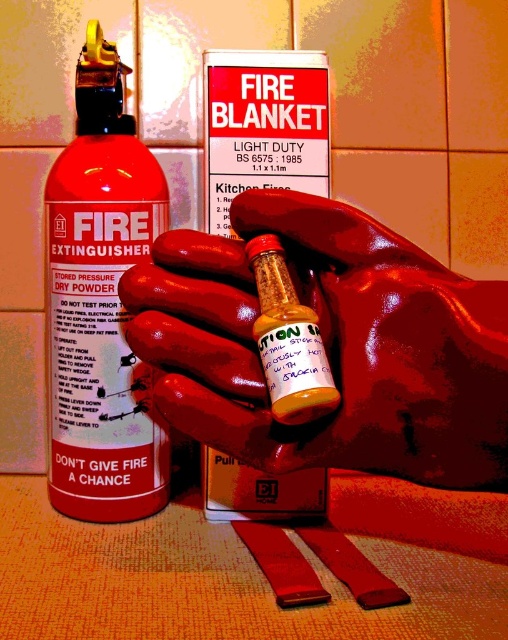
You are a safety inspector checking the placement of items in this scene. The rubber glove at center and the matte black fire extinguisher at left must be visible to workers. Considering their heights, which item might be more easily seen from a distance?

The matte black fire extinguisher at left is taller than the rubber glove at center, so it would be more easily seen from a distance.

You are a safety inspector checking the placement of the rubber glove at center and the matte black fire extinguisher at left. According to safety regulations, the fire extinguisher must be placed above all other equipment to ensure quick access. Is the current arrangement compliant with this rule?

The rubber glove at center is positioned under the matte black fire extinguisher at left, which means the fire extinguisher is above the glove. This placement complies with safety regulations requiring the fire extinguisher to be above other equipment for quick access.